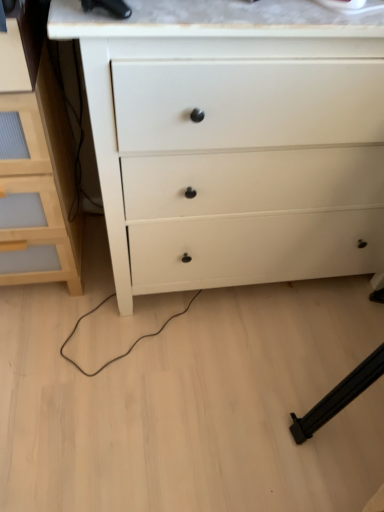
What are the coordinates of `vacant area that is in front of white matte chest of drawers at center, marked as the 1th chest of drawers in a right-to-left arrangement` in the screenshot? It's located at (172, 400).